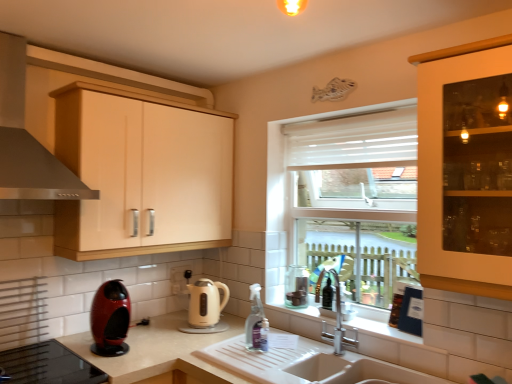
Question: Is satin silver exhaust hood at upper left inside matte wood cabinet at upper left?

Choices:
 (A) yes
 (B) no

Answer: (B)

Question: Considering the relative positions of matte wood cabinet at upper left and satin silver exhaust hood at upper left in the image provided, is matte wood cabinet at upper left in front of satin silver exhaust hood at upper left?

Choices:
 (A) no
 (B) yes

Answer: (A)

Question: Considering the relative sizes of matte wood cabinet at upper left and satin silver exhaust hood at upper left in the image provided, is matte wood cabinet at upper left wider than satin silver exhaust hood at upper left?

Choices:
 (A) yes
 (B) no

Answer: (B)

Question: Is matte wood cabinet at upper left aimed at satin silver exhaust hood at upper left?

Choices:
 (A) no
 (B) yes

Answer: (A)

Question: Can you confirm if matte wood cabinet at upper left is smaller than satin silver exhaust hood at upper left?

Choices:
 (A) no
 (B) yes

Answer: (A)

Question: Considering the positions of white matte countertop at lower left and satin silver exhaust hood at upper left in the image, is white matte countertop at lower left bigger or smaller than satin silver exhaust hood at upper left?

Choices:
 (A) small
 (B) big

Answer: (B)

Question: Is white matte countertop at lower left situated inside satin silver exhaust hood at upper left or outside?

Choices:
 (A) inside
 (B) outside

Answer: (B)

Question: Considering the positions of point (140, 355) and point (1, 109), is point (140, 355) closer or farther from the camera than point (1, 109)?

Choices:
 (A) closer
 (B) farther

Answer: (B)

Question: Is white matte countertop at lower left to the left or to the right of satin silver exhaust hood at upper left in the image?

Choices:
 (A) right
 (B) left

Answer: (A)

Question: From a real-world perspective, relative to matte wood cabinet at upper left, is beige glossy electric kettle at center vertically above or below?

Choices:
 (A) below
 (B) above

Answer: (A)

Question: Looking at the image, does beige glossy electric kettle at center seem bigger or smaller compared to matte wood cabinet at upper left?

Choices:
 (A) big
 (B) small

Answer: (B)

Question: In the image, is beige glossy electric kettle at center on the left side or the right side of matte wood cabinet at upper left?

Choices:
 (A) right
 (B) left

Answer: (A)

Question: From the image's perspective, relative to matte wood cabinet at upper left, is beige glossy electric kettle at center above or below?

Choices:
 (A) above
 (B) below

Answer: (B)

Question: Considering the positions of matte wood cabinet at upper left and clear plastic spray bottle at sink in the image, is matte wood cabinet at upper left bigger or smaller than clear plastic spray bottle at sink?

Choices:
 (A) small
 (B) big

Answer: (B)

Question: From a real-world perspective, is matte wood cabinet at upper left positioned above or below clear plastic spray bottle at sink?

Choices:
 (A) above
 (B) below

Answer: (A)